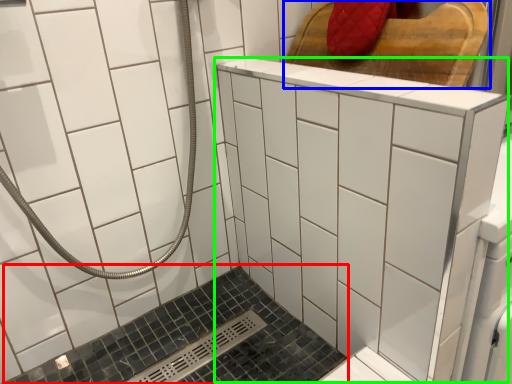
Question: Considering the real-world distances, which object is farthest from bath (highlighted by a red box)? furniture (highlighted by a blue box) or ceramic tile (highlighted by a green box)?

Choices:
 (A) furniture
 (B) ceramic tile

Answer: (A)